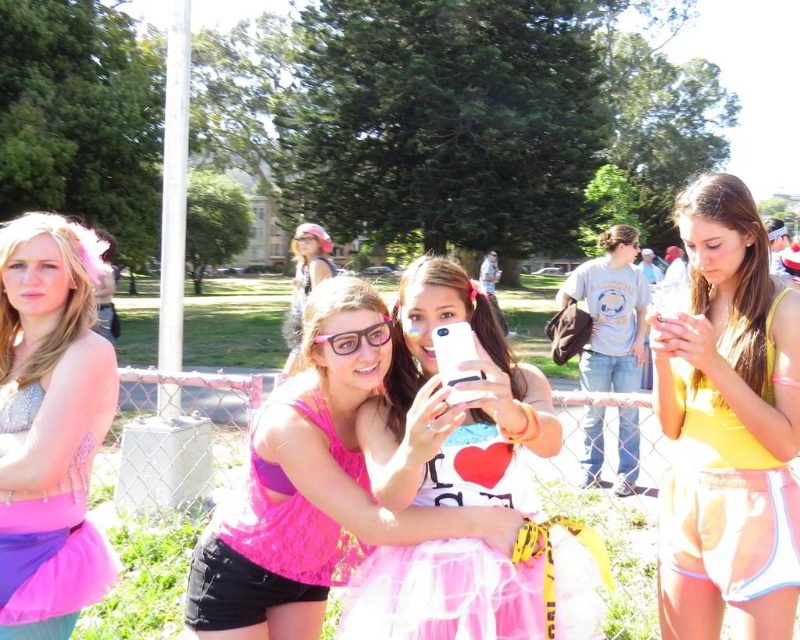
Who is more distant from viewer, (x=644, y=280) or (x=329, y=275)?

Point (x=329, y=275)

The height and width of the screenshot is (640, 800). What do you see at coordinates (610, 312) in the screenshot?
I see `gray cotton t-shirt at center` at bounding box center [610, 312].

Is point (620, 432) positioned before point (302, 310)?

Yes, point (620, 432) is closer to viewer.

The height and width of the screenshot is (640, 800). In order to click on gray cotton t-shirt at center in this screenshot , I will do `click(610, 312)`.

Does pink tulle skirt at center lie in front of gray cotton t-shirt at center?

Yes, pink tulle skirt at center is in front of gray cotton t-shirt at center.

Who is more distant from viewer, (548,452) or (638,372)?

Positioned behind is point (638,372).

Is point (450, 451) farther from camera compared to point (588, 369)?

No.

Where is `pink tulle skirt at center`? pink tulle skirt at center is located at coordinates (452, 404).

The height and width of the screenshot is (640, 800). What do you see at coordinates (728, 426) in the screenshot?
I see `yellow fabric shorts at center` at bounding box center [728, 426].

Can you confirm if yellow fabric shorts at center is positioned to the left of pink fabric dress at center?

Incorrect, yellow fabric shorts at center is not on the left side of pink fabric dress at center.

Who is more distant from viewer, (776,625) or (304,288)?

Point (304,288)

Identify the location of yellow fabric shorts at center. (728, 426).